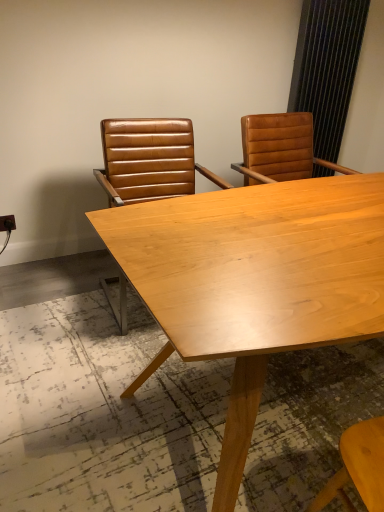
Question: Is light wood table at center smaller than black textured curtain at upper right?

Choices:
 (A) no
 (B) yes

Answer: (A)

Question: Can you confirm if light wood table at center is shorter than black textured curtain at upper right?

Choices:
 (A) yes
 (B) no

Answer: (A)

Question: Would you say light wood table at center is outside black textured curtain at upper right?

Choices:
 (A) no
 (B) yes

Answer: (B)

Question: Is the surface of light wood table at center in direct contact with black textured curtain at upper right?

Choices:
 (A) no
 (B) yes

Answer: (A)

Question: From the image's perspective, is light wood table at center located beneath black textured curtain at upper right?

Choices:
 (A) yes
 (B) no

Answer: (A)

Question: Does point (190, 131) appear closer or farther from the camera than point (162, 269)?

Choices:
 (A) closer
 (B) farther

Answer: (B)

Question: From the image's perspective, relative to light wood table at center, is brown leather chair at center, the 1th chair in the left-to-right sequence, above or below?

Choices:
 (A) above
 (B) below

Answer: (A)

Question: Which is correct: brown leather chair at center, the 1th chair in the left-to-right sequence, is inside light wood table at center, or outside of it?

Choices:
 (A) outside
 (B) inside

Answer: (A)

Question: From a real-world perspective, relative to light wood table at center, is brown leather chair at center, the 1th chair in the left-to-right sequence, vertically above or below?

Choices:
 (A) above
 (B) below

Answer: (A)

Question: Would you say light wood table at center is inside or outside brown leather chair at upper right, which appears as the first chair when viewed from the right?

Choices:
 (A) outside
 (B) inside

Answer: (A)

Question: From a real-world perspective, relative to brown leather chair at upper right, arranged as the second chair when viewed from the left, is light wood table at center vertically above or below?

Choices:
 (A) below
 (B) above

Answer: (A)

Question: From their relative heights in the image, would you say light wood table at center is taller or shorter than brown leather chair at upper right, arranged as the second chair when viewed from the left?

Choices:
 (A) short
 (B) tall

Answer: (B)

Question: Is point tap(215, 357) closer or farther from the camera than point tap(244, 178)?

Choices:
 (A) farther
 (B) closer

Answer: (B)

Question: Is point (160, 358) positioned closer to the camera than point (158, 138)?

Choices:
 (A) closer
 (B) farther

Answer: (A)

Question: From their relative heights in the image, would you say light wood table at center is taller or shorter than brown leather chair at center, the 1th chair in the left-to-right sequence?

Choices:
 (A) tall
 (B) short

Answer: (B)